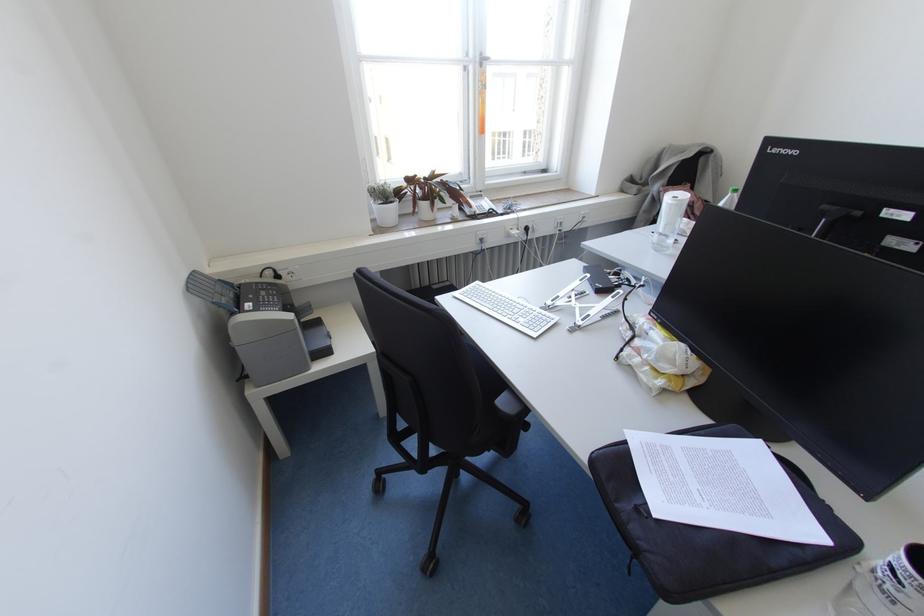
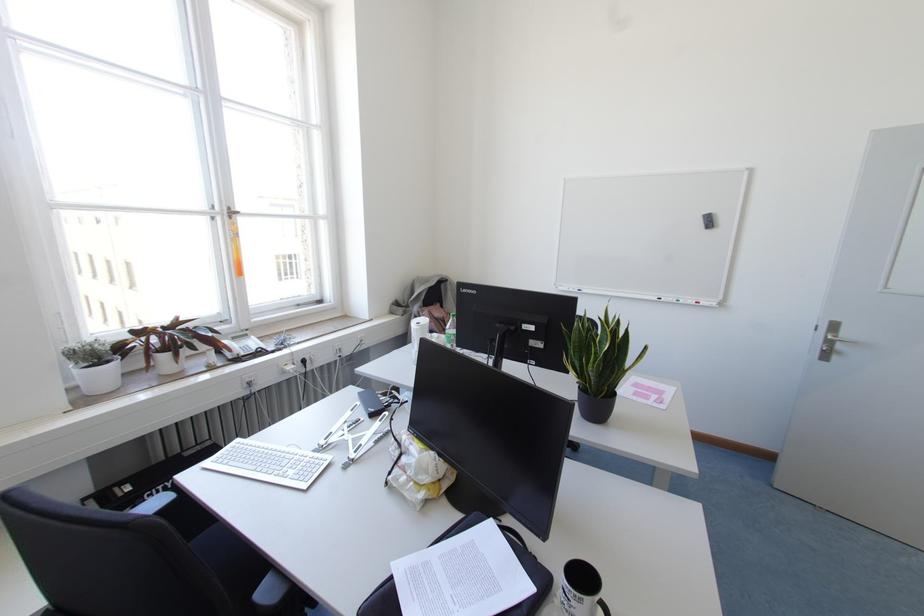
Find the pixel in the second image that matches pixel 480 65 in the first image.

(229, 217)